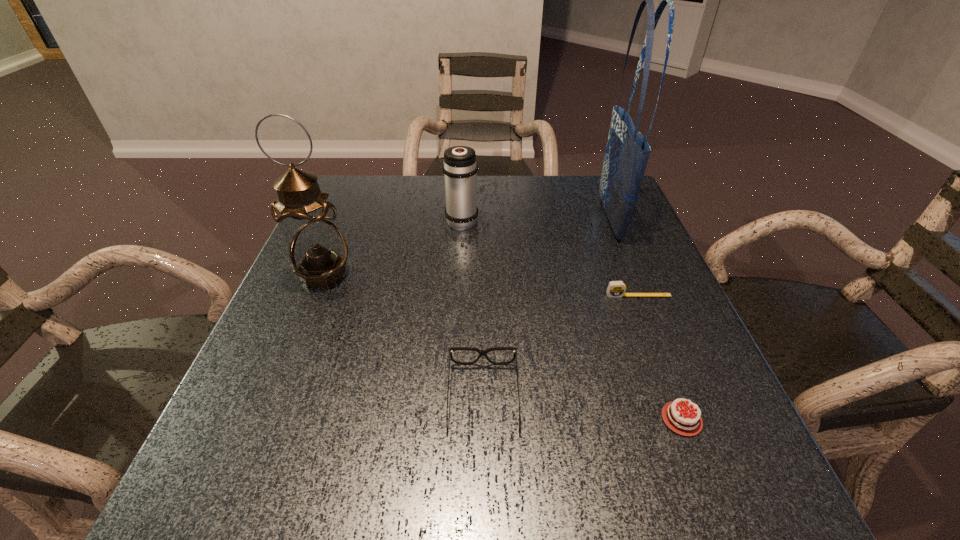
In order to click on the tallest object in this screenshot , I will do `click(627, 151)`.

Locate an element on the screen. The width and height of the screenshot is (960, 540). the third farthest object is located at coordinates (317, 250).

Locate an element on the screen. Image resolution: width=960 pixels, height=540 pixels. the leftmost object is located at coordinates (317, 250).

Find the location of `the third tallest object`. the third tallest object is located at coordinates (460, 169).

Find the location of a particular element. spectacles is located at coordinates (481, 352).

Locate an element on the screen. the fourth farthest object is located at coordinates (616, 289).

Where is `chocolate cake`? The width and height of the screenshot is (960, 540). chocolate cake is located at coordinates (687, 422).

Where is `blank area located 0.080m on the front-facing side of the tallest object`? This screenshot has height=540, width=960. blank area located 0.080m on the front-facing side of the tallest object is located at coordinates (570, 218).

Locate an element on the screen. Image resolution: width=960 pixels, height=540 pixels. vacant space located on the front-facing side of the tallest object is located at coordinates (514, 218).

This screenshot has height=540, width=960. In order to click on free spot located 0.050m on the front-facing side of the tallest object in this screenshot , I will do `click(582, 218)`.